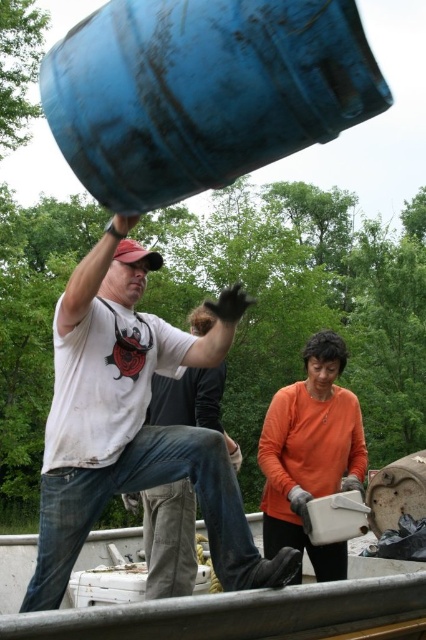
Can you confirm if orange long-sleeve shirt at center is smaller than white t-shirt at center?

No.

Which of these two, orange long-sleeve shirt at center or white t-shirt at center, stands shorter?

white t-shirt at center is shorter.

I want to click on orange long-sleeve shirt at center, so click(310, 452).

Is point (219, 61) in front of point (138, 268)?

Yes, it is in front of point (138, 268).

Is blue matte barrel at upper center closer to the viewer compared to white matte t-shirt at center?

Yes, blue matte barrel at upper center is closer to the viewer.

Which is behind, point (294, 120) or point (129, 321)?

The point (129, 321) is more distant.

Find the location of a particular element. This screenshot has width=426, height=640. blue matte barrel at upper center is located at coordinates (203, 92).

Does point (155, 106) lie behind point (198, 390)?

That is False.

Who is more distant from viewer, (154, 168) or (149, 406)?

The point (149, 406) is more distant.

Locate an element on the screen. The image size is (426, 640). blue matte barrel at upper center is located at coordinates (203, 92).